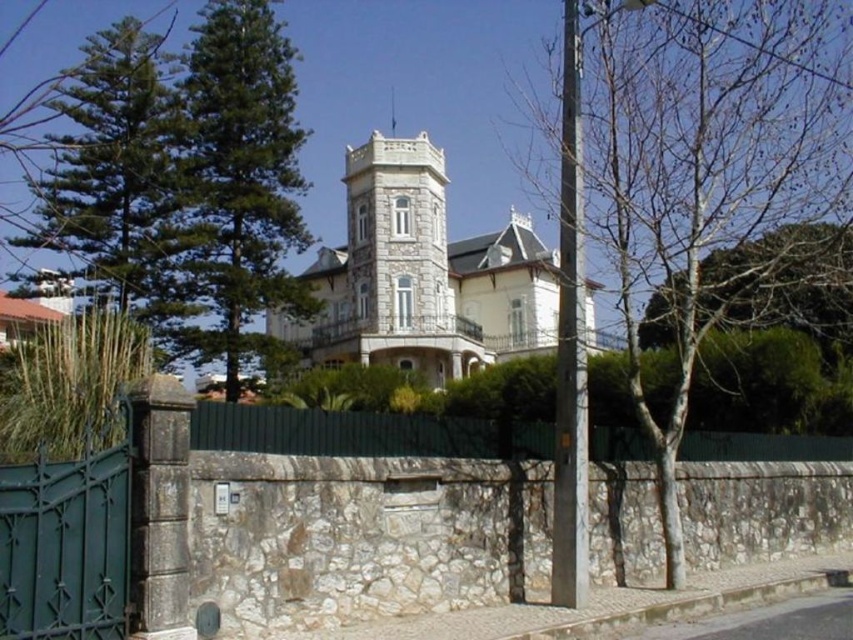
Is green needle-like foliage at left below green wrought iron gate at lower left?

No, green needle-like foliage at left is not below green wrought iron gate at lower left.

Which is in front, point (267, 93) or point (38, 556)?

Positioned in front is point (38, 556).

At what (x,y) coordinates should I click in order to perform the action: click on green needle-like foliage at left. Please return your answer as a coordinate pair (x, y). This screenshot has height=640, width=853. Looking at the image, I should click on (242, 179).

Who is higher up, green needle-like foliage at left or green metal fence at lower center?

Positioned higher is green needle-like foliage at left.

Who is positioned more to the right, green needle-like foliage at left or green metal fence at lower center?

From the viewer's perspective, green metal fence at lower center appears more on the right side.

The width and height of the screenshot is (853, 640). Describe the element at coordinates (242, 179) in the screenshot. I see `green needle-like foliage at left` at that location.

Identify the location of green needle-like foliage at left. (242, 179).

Is the position of green leafy tree at left less distant than that of green wrought iron gate at lower left?

No.

Is point (80, 292) farther from camera compared to point (100, 566)?

Yes, it is behind point (100, 566).

Image resolution: width=853 pixels, height=640 pixels. Find the location of `green leafy tree at left`. green leafy tree at left is located at coordinates (120, 182).

Identify the location of green leafy tree at left. The height and width of the screenshot is (640, 853). (120, 182).